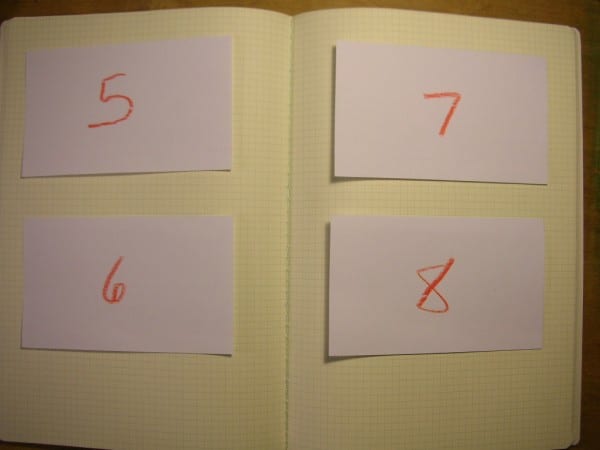
At what (x,y) coordinates should I click in order to perform the action: click on book. Please return your answer as a coordinate pair (x, y). Looking at the image, I should click on (287, 124).